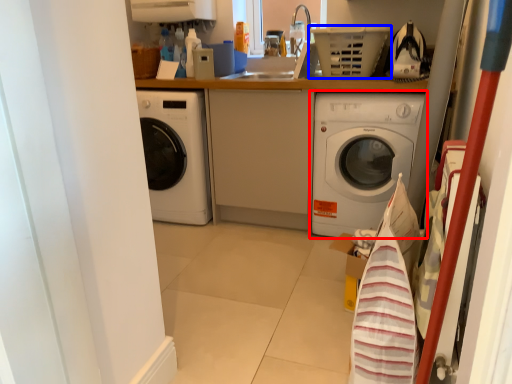
Question: Which of the following is the closest to the observer, washing machine (highlighted by a red box) or basket (highlighted by a blue box)?

Choices:
 (A) washing machine
 (B) basket

Answer: (B)